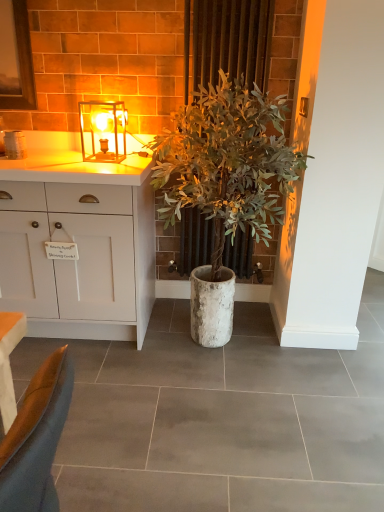
Question: Is green leafy plant at center oriented towards matte glass lamp at upper center?

Choices:
 (A) yes
 (B) no

Answer: (B)

Question: From the image's perspective, is green leafy plant at center on matte glass lamp at upper center?

Choices:
 (A) no
 (B) yes

Answer: (A)

Question: Is green leafy plant at center oriented away from matte glass lamp at upper center?

Choices:
 (A) yes
 (B) no

Answer: (A)

Question: Does green leafy plant at center lie in front of matte glass lamp at upper center?

Choices:
 (A) yes
 (B) no

Answer: (A)

Question: Would you say green leafy plant at center is a long distance from matte glass lamp at upper center?

Choices:
 (A) no
 (B) yes

Answer: (A)

Question: Does green leafy plant at center have a lesser height compared to matte glass lamp at upper center?

Choices:
 (A) no
 (B) yes

Answer: (A)

Question: From a real-world perspective, does matte glass lamp at upper center sit lower than green leafy plant at center?

Choices:
 (A) no
 (B) yes

Answer: (A)

Question: Is green leafy plant at center at the back of matte glass lamp at upper center?

Choices:
 (A) yes
 (B) no

Answer: (B)

Question: From a real-world perspective, is matte glass lamp at upper center over green leafy plant at center?

Choices:
 (A) no
 (B) yes

Answer: (B)

Question: Could you tell me if matte glass lamp at upper center is facing green leafy plant at center?

Choices:
 (A) yes
 (B) no

Answer: (B)

Question: From the image's perspective, does matte glass lamp at upper center appear higher than green leafy plant at center?

Choices:
 (A) yes
 (B) no

Answer: (A)

Question: Would you say matte glass lamp at upper center is outside green leafy plant at center?

Choices:
 (A) yes
 (B) no

Answer: (A)

Question: Are matte glass lamp at upper center and green leafy plant at center beside each other?

Choices:
 (A) no
 (B) yes

Answer: (A)